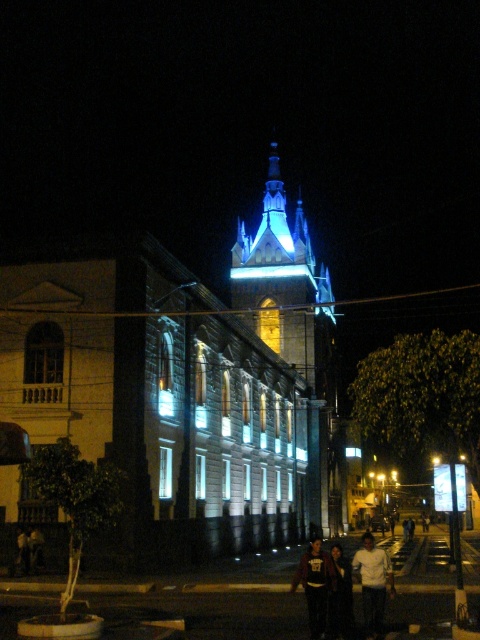
Does blue glassy tower at upper center appear under dark blue hoodie at lower center?

No, blue glassy tower at upper center is not below dark blue hoodie at lower center.

Which is more to the left, blue glassy tower at upper center or dark blue hoodie at lower center?

Positioned to the left is dark blue hoodie at lower center.

Between point (294, 275) and point (319, 604), which one is positioned behind?

The point (294, 275) is more distant.

You are a GUI agent. You are given a task and a screenshot of the screen. Output one action in this format:
    pyautogui.click(x=<x>, y=<y>)
    Task: Click on the blue glassy tower at upper center
    Image resolution: width=480 pixels, height=640 pixels.
    Given the screenshot: What is the action you would take?
    pyautogui.click(x=286, y=288)

The image size is (480, 640). Identify the location of white matte shirt at center. (372, 582).

Who is more distant from viewer, (374,564) or (332,570)?

Positioned behind is point (374,564).

Locate an element on the screen. Image resolution: width=480 pixels, height=640 pixels. white matte shirt at center is located at coordinates (372, 582).

Is blue glassy tower at upper center behind white matte shirt at center?

Yes, blue glassy tower at upper center is further from the viewer.

Between blue glassy tower at upper center and white matte shirt at center, which one appears on the right side from the viewer's perspective?

white matte shirt at center is more to the right.

Locate an element on the screen. blue glassy tower at upper center is located at coordinates (286, 288).

You are a GUI agent. You are given a task and a screenshot of the screen. Output one action in this format:
    pyautogui.click(x=<x>, y=<y>)
    Task: Click on the blue glassy tower at upper center
    
    Given the screenshot: What is the action you would take?
    pyautogui.click(x=286, y=288)